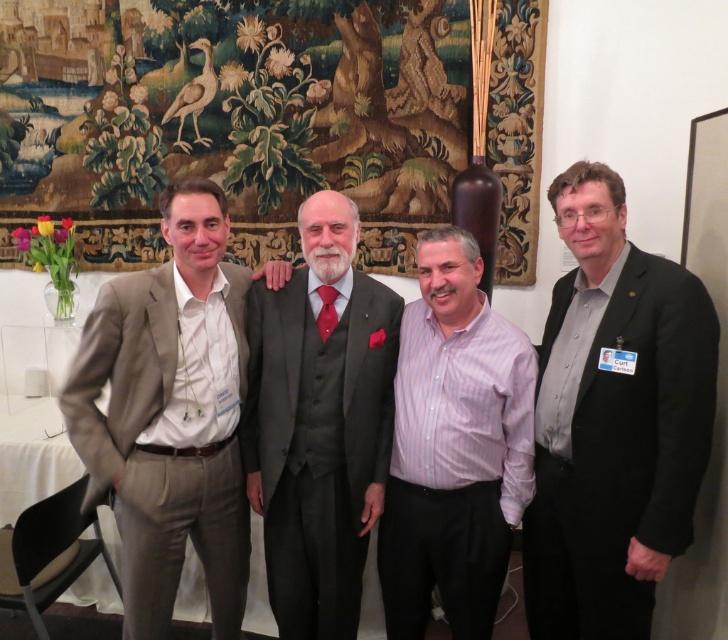
Question: Which of the following is the farthest from the observer?

Choices:
 (A) matte beige suit at center
 (B) purple striped shirt at center
 (C) dark gray suit at center
 (D) black matte suit at right

Answer: (C)

Question: Among these objects, which one is farthest from the camera?

Choices:
 (A) purple striped shirt at center
 (B) matte beige suit at center
 (C) black matte suit at right

Answer: (A)

Question: Which object appears closest to the camera in this image?

Choices:
 (A) dark gray suit at center
 (B) black matte suit at right
 (C) matte beige suit at center
 (D) purple striped shirt at center

Answer: (B)

Question: Can you confirm if matte beige suit at center is positioned above dark gray suit at center?

Choices:
 (A) no
 (B) yes

Answer: (A)

Question: Is black matte suit at right further to camera compared to purple striped shirt at center?

Choices:
 (A) no
 (B) yes

Answer: (A)

Question: Is dark gray suit at center below purple striped shirt at center?

Choices:
 (A) no
 (B) yes

Answer: (A)